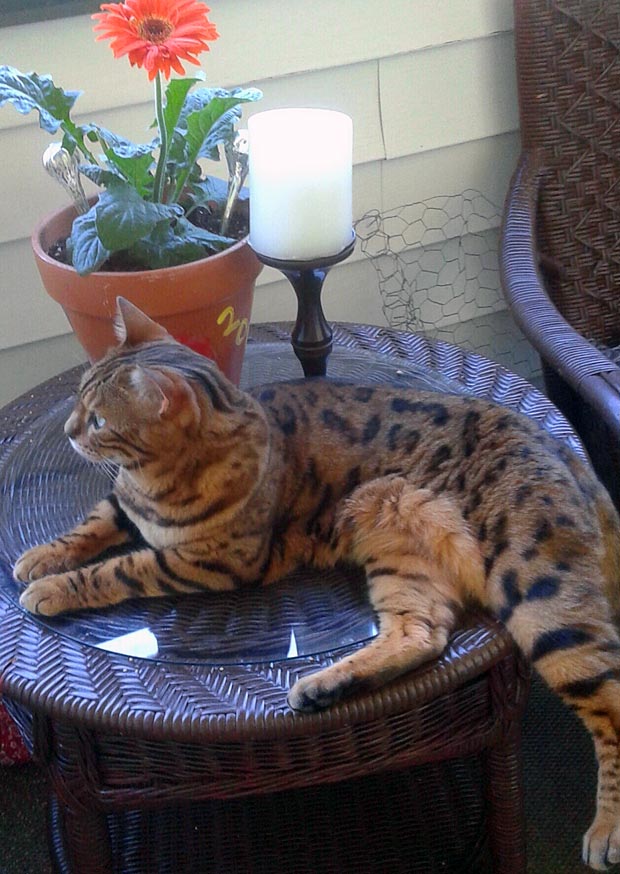
Where is `planter pot`? The image size is (620, 874). planter pot is located at coordinates (186, 281).